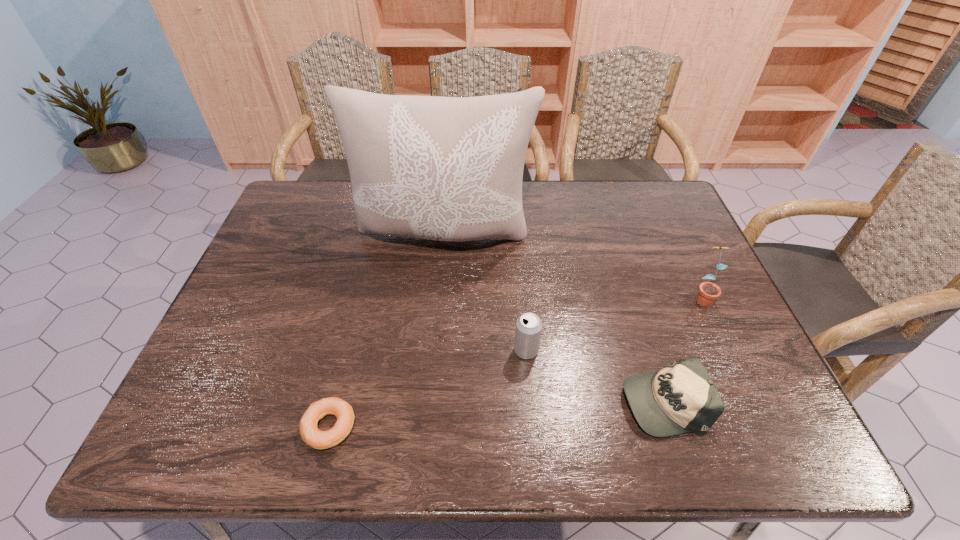
Locate an element on the screen. vacant region between the third farthest object and the baseball cap is located at coordinates (594, 376).

Where is `empty space that is in between the sunflower and the third farthest object`? This screenshot has width=960, height=540. empty space that is in between the sunflower and the third farthest object is located at coordinates click(613, 323).

Find the location of a particular element. This screenshot has height=540, width=960. free space between the fourth tallest object and the bagel is located at coordinates (496, 414).

Locate an element on the screen. The width and height of the screenshot is (960, 540). free space between the farthest object and the second farthest object is located at coordinates (573, 266).

Find the location of a particular element. This screenshot has width=960, height=540. unoccupied position between the third tallest object and the baseball cap is located at coordinates (594, 376).

I want to click on unoccupied area between the sunflower and the bagel, so click(516, 362).

The width and height of the screenshot is (960, 540). Find the location of `object that is the closest one to the cushion`. object that is the closest one to the cushion is located at coordinates (528, 326).

Locate an element on the screen. object identified as the third closest to the bagel is located at coordinates (680, 398).

At what (x,y) coordinates should I click in order to perform the action: click on free location that satisfies the following two spatial constraints: 1. on the front-facing side of the second object from right to left; 2. on the front side of the bagel. Please return your answer as a coordinate pair (x, y). The height and width of the screenshot is (540, 960). Looking at the image, I should click on (671, 427).

You are a GUI agent. You are given a task and a screenshot of the screen. Output one action in this format:
    pyautogui.click(x=<x>, y=<y>)
    Task: Click on the vacant area that satisfies the following two spatial constraints: 1. on the back side of the shortest object; 2. on the right side of the beer can
    The height and width of the screenshot is (540, 960).
    Given the screenshot: What is the action you would take?
    pyautogui.click(x=348, y=350)